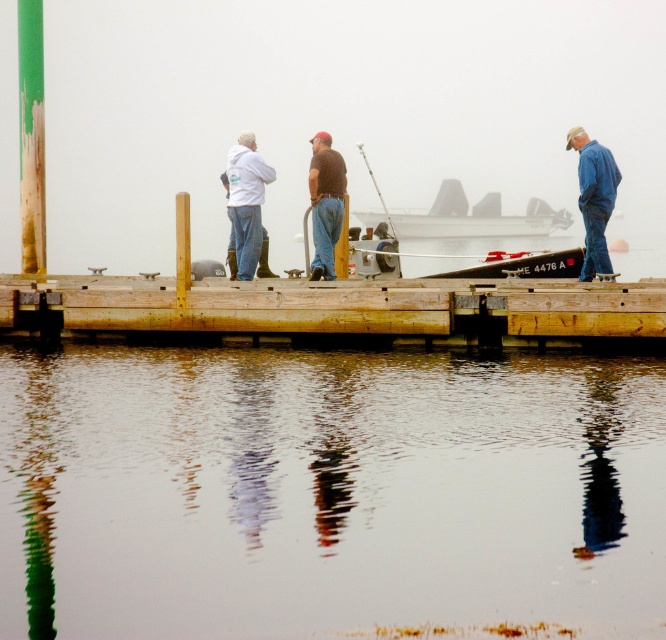
Question: Which point is farther from the camera taking this photo?

Choices:
 (A) (262, 180)
 (B) (444, 524)

Answer: (A)

Question: Which of the following is the farthest from the observer?

Choices:
 (A) (577, 172)
 (B) (254, 304)
 (C) (322, 205)
 (D) (398, 417)

Answer: (C)

Question: Is smooth reflective water at center wider than brown matte shirt at center?

Choices:
 (A) no
 (B) yes

Answer: (B)

Question: Is smooth reflective water at center smaller than blue denim jeans at right?

Choices:
 (A) yes
 (B) no

Answer: (B)

Question: Can you confirm if weathered wood dock at center is positioned to the right of white matte boat at center?

Choices:
 (A) yes
 (B) no

Answer: (B)

Question: Which point appears farthest from the camera in this image?

Choices:
 (A) (543, 216)
 (B) (298, 392)
 (C) (589, 321)

Answer: (A)